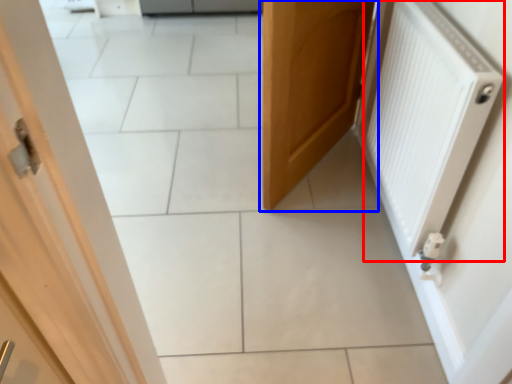
Question: Which point is further to the camera, radiator (highlighted by a red box) or door (highlighted by a blue box)?

Choices:
 (A) radiator
 (B) door

Answer: (B)